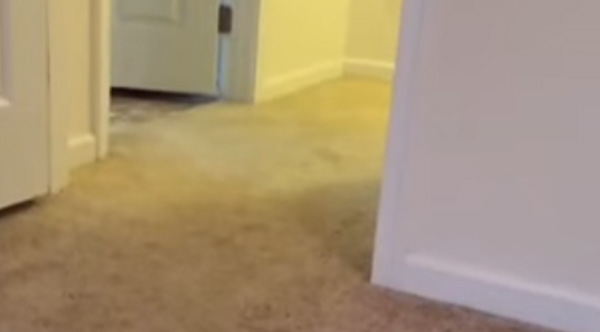
The width and height of the screenshot is (600, 332). What are the coordinates of `door frame` in the screenshot? It's located at tap(243, 37).